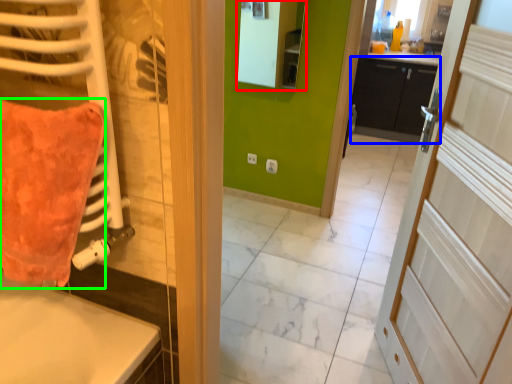
Question: Considering the real-world distances, which object is farthest from mirror (highlighted by a red box)? cabinetry (highlighted by a blue box) or throw pillow (highlighted by a green box)?

Choices:
 (A) cabinetry
 (B) throw pillow

Answer: (B)